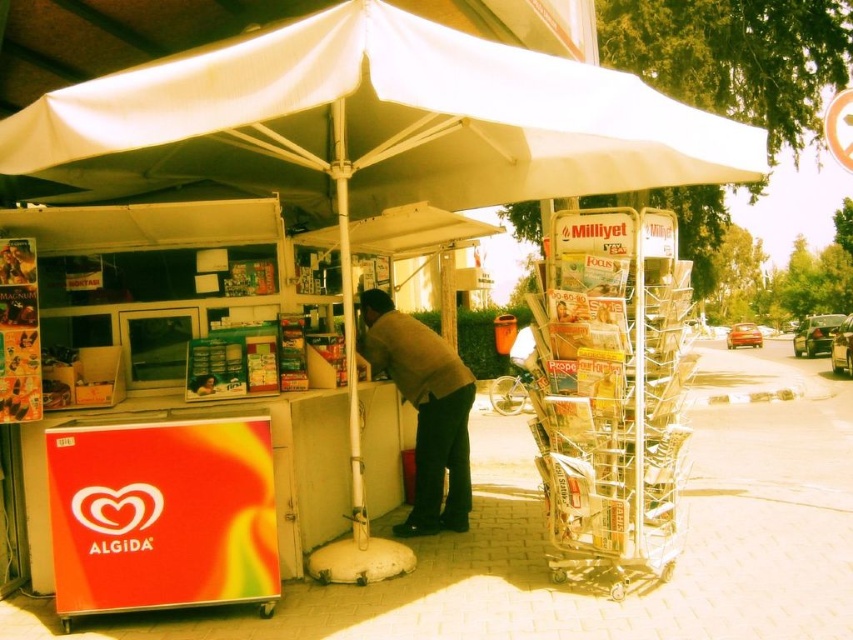
You are a customer at the kiosk and want to place a large bag on the floor next to the metallic silver magazine rack at right. Will the brown woolen sweater at center interfere with this action?

The metallic silver magazine rack at right has a larger size compared to brown woolen sweater at center, so placing the bag next to the magazine rack should not be obstructed by the sweater since the rack is bigger and likely occupies more space.

You are a customer standing in front of the kiosk. You need to reach the metallic silver magazine rack at right but there is a white fabric canopy at center in the way. Can you walk under the canopy to reach the magazine rack?

The white fabric canopy at center is shorter than metallic silver magazine rack at right, so the canopy is lower than the magazine rack. Since the canopy is shorter, you can walk under it to reach the metallic silver magazine rack at right without any obstruction.